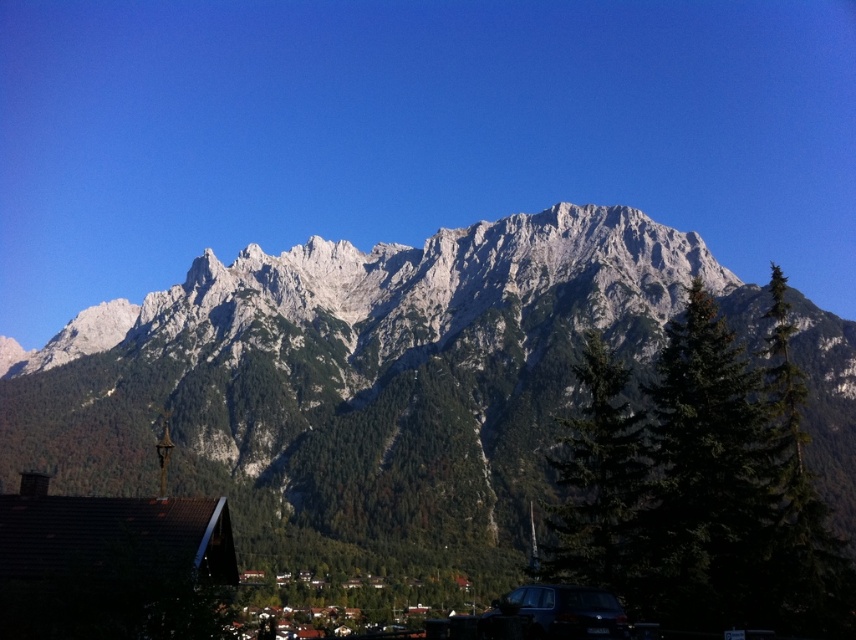
You are a hiker planning to navigate between the two points marked in the image. Which point, point (x=782, y=476) or point (x=635, y=531), is closer to you as you stand at the starting point?

Point (x=782, y=476) is closer to the viewer than point (x=635, y=531).

You are standing at the origin point of the coordinate system. You want to reach the green textured tree at center. Which direction should you move in? Please provide your answer in terms of the coordinate system used in the image. The coordinate system has the origin at the bottom left corner, with the x and y axes increasing to the right and upwards respectively.

To reach the green textured tree at center located at coordinate point (599, 483), you should move towards the northeast direction. This is because the x coordinate is greater than 0.5 and the y coordinate is also greater than 0.5, indicating a position in the upper right quadrant of the image. Specifically, moving northeast would align with increasing both the x and y values from the origin at the bottom left corner.

You are standing at a viewpoint in the mountain area and want to take a photo of the landscape. The camera you are using has a depth sensor that can measure distances. If you point your camera at point (580, 518) in the image coordinates, what would be the distance reading shown on your camera?

The distance of point (580, 518) from the camera is 136.47 meters, so the camera would display 136.47 meters.